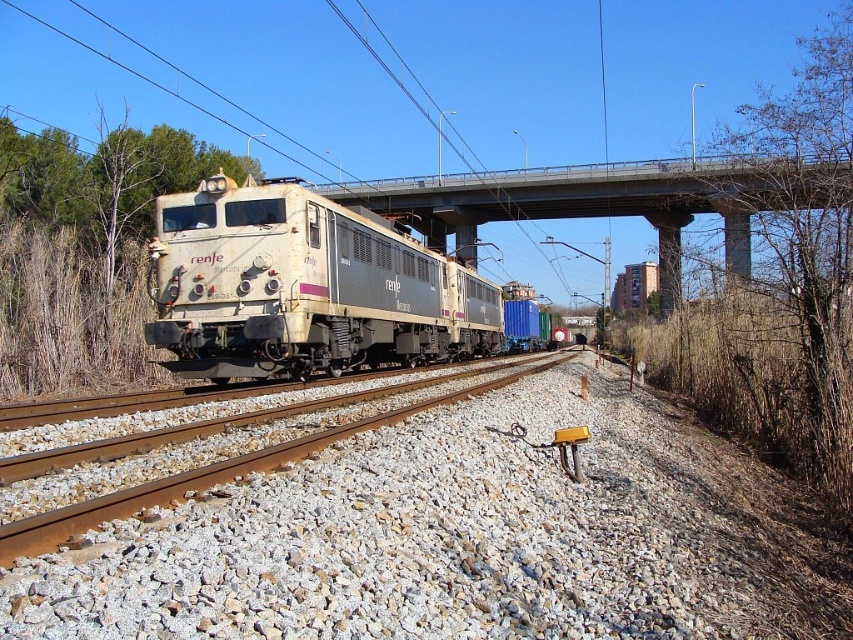
Question: Is white matte train at center further to the viewer compared to concrete bridge at center?

Choices:
 (A) no
 (B) yes

Answer: (B)

Question: Is white matte train at center to the left of concrete bridge at center from the viewer's perspective?

Choices:
 (A) no
 (B) yes

Answer: (B)

Question: Which point is closer to the camera?

Choices:
 (A) (759, 177)
 (B) (405, 356)

Answer: (A)

Question: Which point appears farthest from the camera in this image?

Choices:
 (A) (161, 220)
 (B) (531, 196)

Answer: (B)

Question: Can you confirm if white matte train at center is positioned below concrete bridge at center?

Choices:
 (A) yes
 (B) no

Answer: (A)